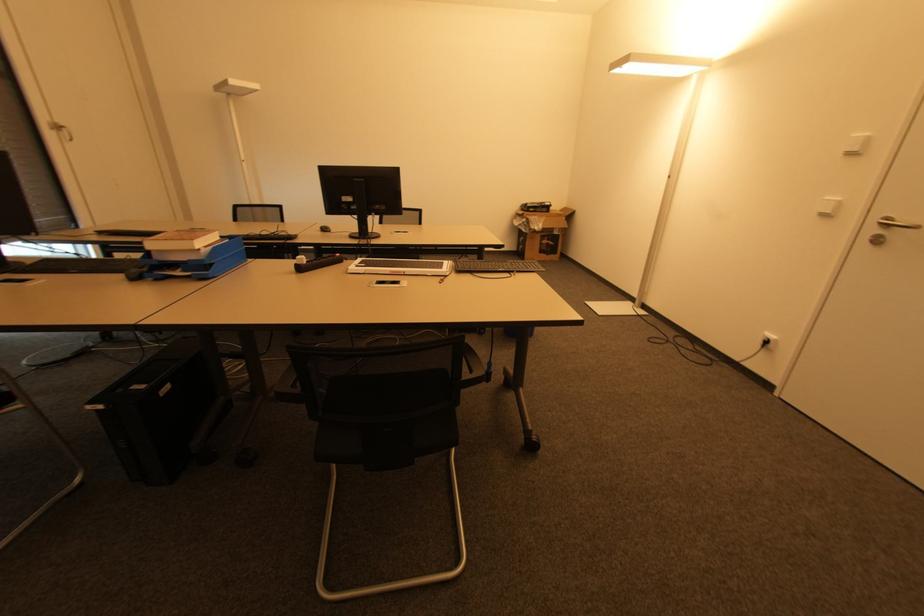
Where would you lift the stacked books? Please return your answer as a coordinate pair (x, y).

(188, 254)